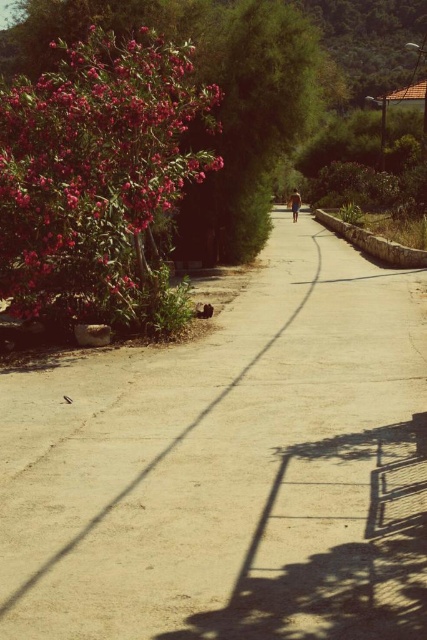
Is dirt track at center positioned in front of blue denim shorts at center?

Yes, it is in front of blue denim shorts at center.

Which is in front, point (423, 356) or point (298, 208)?

Point (423, 356)

What do you see at coordinates (243, 474) in the screenshot? I see `dirt track at center` at bounding box center [243, 474].

Locate an element on the screen. The height and width of the screenshot is (640, 427). dirt track at center is located at coordinates (243, 474).

Consider the image. Can you confirm if dirt track at center is positioned above matte pink flowers at left?

Actually, dirt track at center is below matte pink flowers at left.

Who is higher up, dirt track at center or matte pink flowers at left?

matte pink flowers at left is above.

Measure the distance between dirt track at center and camera.

The distance of dirt track at center from camera is 3.70 meters.

The width and height of the screenshot is (427, 640). I want to click on dirt track at center, so 243,474.

Looking at this image, can you confirm if matte pink flowers at left is smaller than blue denim shorts at center?

Indeed, matte pink flowers at left has a smaller size compared to blue denim shorts at center.

Who is higher up, matte pink flowers at left or blue denim shorts at center?

blue denim shorts at center is higher up.

Is point (136, 301) positioned after point (294, 198)?

No, (136, 301) is closer to viewer.

The image size is (427, 640). I want to click on matte pink flowers at left, so click(93, 172).